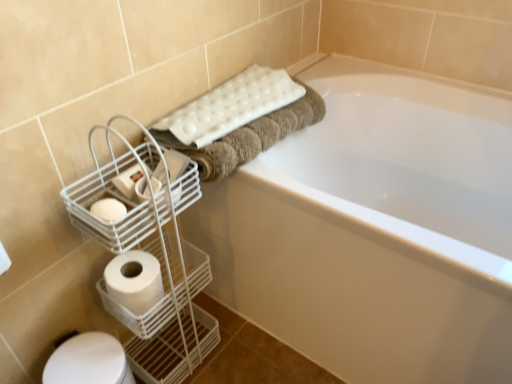
This screenshot has width=512, height=384. I want to click on white wire basket at left, so click(153, 257).

The image size is (512, 384). What do you see at coordinates (382, 230) in the screenshot?
I see `white glossy bathtub at upper center` at bounding box center [382, 230].

Measure the distance between white glossy bathtub at upper center and camera.

They are 26.28 inches apart.

Image resolution: width=512 pixels, height=384 pixels. Describe the element at coordinates (227, 108) in the screenshot. I see `white textured bath towel at upper center` at that location.

Where is `white matte toilet paper at lower left, the second toilet paper when ordered from top to bottom`? The image size is (512, 384). white matte toilet paper at lower left, the second toilet paper when ordered from top to bottom is located at coordinates (134, 280).

Between white textured bath towel at upper center and white matte toilet paper at left, acting as the second toilet paper starting from the bottom, which one has more height?

white textured bath towel at upper center.

Looking at this image, is white textured bath towel at upper center in front of or behind white matte toilet paper at left, acting as the second toilet paper starting from the bottom, in the image?

white textured bath towel at upper center is positioned farther from the viewer than white matte toilet paper at left, acting as the second toilet paper starting from the bottom.

Is white textured bath towel at upper center surrounding white matte toilet paper at left, acting as the second toilet paper starting from the bottom?

No, white textured bath towel at upper center does not contain white matte toilet paper at left, acting as the second toilet paper starting from the bottom.

Would you say white wire basket at left is a long distance from white matte toilet paper at left, the 1th toilet paper from the top?

No, white wire basket at left is not far from white matte toilet paper at left, the 1th toilet paper from the top.

Is white matte toilet paper at left, the 1th toilet paper from the top, surrounded by white wire basket at left?

Yes, white matte toilet paper at left, the 1th toilet paper from the top, is surrounded by white wire basket at left.

Where is `bird cage below the white matte toilet paper at left, the 1th toilet paper from the top (from a real-world perspective)`? This screenshot has width=512, height=384. bird cage below the white matte toilet paper at left, the 1th toilet paper from the top (from a real-world perspective) is located at coordinates (153, 257).

Does white matte toilet paper at lower left, the first toilet paper ordered from the bottom, have a lesser height compared to white matte toilet paper at left, the 1th toilet paper from the top?

Incorrect, the height of white matte toilet paper at lower left, the first toilet paper ordered from the bottom, does not fall short of that of white matte toilet paper at left, the 1th toilet paper from the top.

From a real-world perspective, is white matte toilet paper at lower left, the first toilet paper ordered from the bottom, positioned above or below white matte toilet paper at left, the 1th toilet paper from the top?

white matte toilet paper at lower left, the first toilet paper ordered from the bottom, is situated lower than white matte toilet paper at left, the 1th toilet paper from the top, in the real world.

Are white matte toilet paper at lower left, the first toilet paper ordered from the bottom, and white matte toilet paper at left, acting as the second toilet paper starting from the bottom, far apart?

No, white matte toilet paper at lower left, the first toilet paper ordered from the bottom, is in close proximity to white matte toilet paper at left, acting as the second toilet paper starting from the bottom.

From the image's perspective, is white matte toilet paper at lower left, the second toilet paper when ordered from top to bottom, positioned above or below white matte toilet paper at left, the 1th toilet paper from the top?

Clearly, from the image's perspective, white matte toilet paper at lower left, the second toilet paper when ordered from top to bottom, is below white matte toilet paper at left, the 1th toilet paper from the top.

From a real-world perspective, does white matte toilet paper at lower left, the second toilet paper when ordered from top to bottom, sit lower than white glossy bathtub at upper center?

No.

What's the angular difference between white matte toilet paper at lower left, the first toilet paper ordered from the bottom, and white glossy bathtub at upper center's facing directions?

white matte toilet paper at lower left, the first toilet paper ordered from the bottom, and white glossy bathtub at upper center are facing 89.2 degrees away from each other.

Which of these two, white matte toilet paper at lower left, the first toilet paper ordered from the bottom, or white glossy bathtub at upper center, stands taller?

With more height is white glossy bathtub at upper center.

Is point (155, 285) positioned after point (342, 296)?

Yes.

Could you tell me if white glossy bathtub at upper center is facing white matte toilet paper at lower left, the second toilet paper when ordered from top to bottom?

Yes.

Would you say white glossy bathtub at upper center is a long distance from white matte toilet paper at lower left, the second toilet paper when ordered from top to bottom?

No.

Which of these two, white glossy bathtub at upper center or white matte toilet paper at lower left, the first toilet paper ordered from the bottom, is smaller?

Smaller between the two is white matte toilet paper at lower left, the first toilet paper ordered from the bottom.

In the scene shown: Which is farther, (419,243) or (131,288)?

Point (131,288)

Where is `bird cage above the white glossy bathtub at upper center (from a real-world perspective)`? This screenshot has width=512, height=384. bird cage above the white glossy bathtub at upper center (from a real-world perspective) is located at coordinates (153, 257).

Considering the sizes of white glossy bathtub at upper center and white wire basket at left in the image, is white glossy bathtub at upper center bigger or smaller than white wire basket at left?

Considering their sizes, white glossy bathtub at upper center takes up more space than white wire basket at left.

What's the angular difference between white glossy bathtub at upper center and white wire basket at left's facing directions?

There is a 89.2-degree angle between the facing directions of white glossy bathtub at upper center and white wire basket at left.

Is white glossy bathtub at upper center completely or partially outside of white wire basket at left?

Yes, white glossy bathtub at upper center is not within white wire basket at left.

Is point (207, 133) farther from viewer compared to point (209, 319)?

No.

Which of these two, white textured bath towel at upper center or white wire basket at left, is smaller?

white textured bath towel at upper center is smaller.

From the image's perspective, would you say white textured bath towel at upper center is positioned over white wire basket at left?

Correct, white textured bath towel at upper center appears higher than white wire basket at left in the image.

Is the surface of white textured bath towel at upper center in direct contact with white wire basket at left?

They are not placed beside each other.

You are a GUI agent. You are given a task and a screenshot of the screen. Output one action in this format:
    pyautogui.click(x=<x>, y=<y>)
    Task: Click on the toilet paper that is the 1st one below the white textured bath towel at upper center (from a real-world perspective)
    
    Given the screenshot: What is the action you would take?
    pyautogui.click(x=130, y=179)

Find the location of a particular element. The width and height of the screenshot is (512, 384). the 1st toilet paper counting from the left of the white wire basket at left is located at coordinates coord(130,179).

When comparing their distances from white textured bath towel at upper center, does white wire basket at left or white matte toilet paper at lower left, the first toilet paper ordered from the bottom, seem further?

white matte toilet paper at lower left, the first toilet paper ordered from the bottom, is further to white textured bath towel at upper center.

Based on their spatial positions, is white glossy bathtub at upper center or white textured bath towel at upper center closer to white matte toilet paper at lower left, the first toilet paper ordered from the bottom?

The object closer to white matte toilet paper at lower left, the first toilet paper ordered from the bottom, is white textured bath towel at upper center.

From the image, which object appears to be farther from white matte toilet paper at lower left, the second toilet paper when ordered from top to bottom, white textured bath towel at upper center or white matte toilet paper at left, the 1th toilet paper from the top?

white textured bath towel at upper center is positioned further to the anchor white matte toilet paper at lower left, the second toilet paper when ordered from top to bottom.

Looking at the image, which one is located closer to white wire basket at left, white matte toilet paper at lower left, the first toilet paper ordered from the bottom, or white glossy bathtub at upper center?

The object closer to white wire basket at left is white matte toilet paper at lower left, the first toilet paper ordered from the bottom.

Estimate the real-world distances between objects in this image. Which object is closer to white wire basket at left, white matte toilet paper at left, the 1th toilet paper from the top, or white matte toilet paper at lower left, the first toilet paper ordered from the bottom?

The object closer to white wire basket at left is white matte toilet paper at lower left, the first toilet paper ordered from the bottom.

When comparing their distances from white matte toilet paper at left, acting as the second toilet paper starting from the bottom, does white glossy bathtub at upper center or white wire basket at left seem further?

Based on the image, white glossy bathtub at upper center appears to be further to white matte toilet paper at left, acting as the second toilet paper starting from the bottom.

Considering their positions, is white matte toilet paper at left, the 1th toilet paper from the top, positioned further to white matte toilet paper at lower left, the first toilet paper ordered from the bottom, than white textured bath towel at upper center?

white textured bath towel at upper center is further to white matte toilet paper at lower left, the first toilet paper ordered from the bottom.

From the image, which object appears to be farther from white matte toilet paper at lower left, the second toilet paper when ordered from top to bottom, white matte toilet paper at left, acting as the second toilet paper starting from the bottom, or white wire basket at left?

Based on the image, white matte toilet paper at left, acting as the second toilet paper starting from the bottom, appears to be further to white matte toilet paper at lower left, the second toilet paper when ordered from top to bottom.

You are a GUI agent. You are given a task and a screenshot of the screen. Output one action in this format:
    pyautogui.click(x=<x>, y=<y>)
    Task: Click on the toilet paper between white wire basket at left and white matte toilet paper at lower left, the second toilet paper when ordered from top to bottom, along the z-axis
    
    Given the screenshot: What is the action you would take?
    pyautogui.click(x=130, y=179)

You are a GUI agent. You are given a task and a screenshot of the screen. Output one action in this format:
    pyautogui.click(x=<x>, y=<y>)
    Task: Click on the bird cage between white matte toilet paper at left, acting as the second toilet paper starting from the bottom, and white glossy bathtub at upper center, in the horizontal direction
    
    Given the screenshot: What is the action you would take?
    coord(153,257)

I want to click on bath towel located between white wire basket at left and white glossy bathtub at upper center in the left-right direction, so click(x=227, y=108).

This screenshot has height=384, width=512. I want to click on bird cage between white textured bath towel at upper center and white matte toilet paper at lower left, the second toilet paper when ordered from top to bottom, in the vertical direction, so click(153, 257).